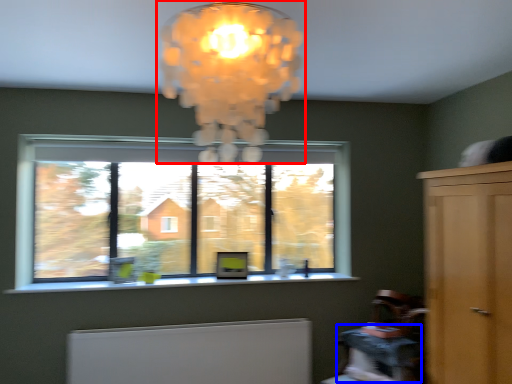
Question: Which object appears farthest to the camera in this image, lamp (highlighted by a red box) or table (highlighted by a blue box)?

Choices:
 (A) lamp
 (B) table

Answer: (B)